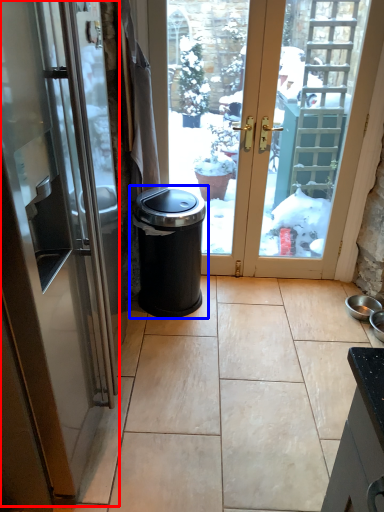
Question: Which object is closer to the camera taking this photo, door (highlighted by a red box) or waste container (highlighted by a blue box)?

Choices:
 (A) door
 (B) waste container

Answer: (A)